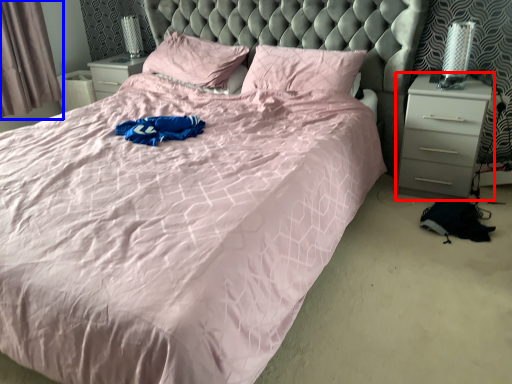
Question: Which object is closer to the camera taking this photo, nightstand (highlighted by a red box) or curtain (highlighted by a blue box)?

Choices:
 (A) nightstand
 (B) curtain

Answer: (A)